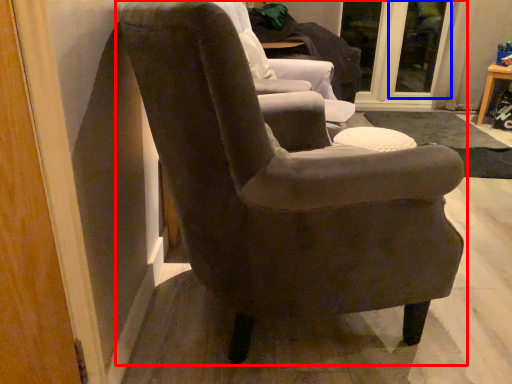
Question: Which object appears closest to the camera in this image, chair (highlighted by a red box) or glass door (highlighted by a blue box)?

Choices:
 (A) chair
 (B) glass door

Answer: (A)